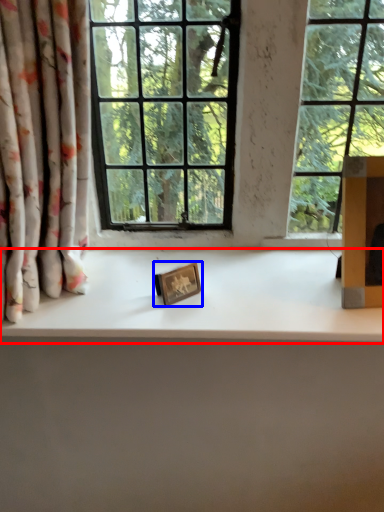
Question: Which point is closer to the camera, counter top (highlighted by a red box) or picture frame (highlighted by a blue box)?

Choices:
 (A) counter top
 (B) picture frame

Answer: (A)